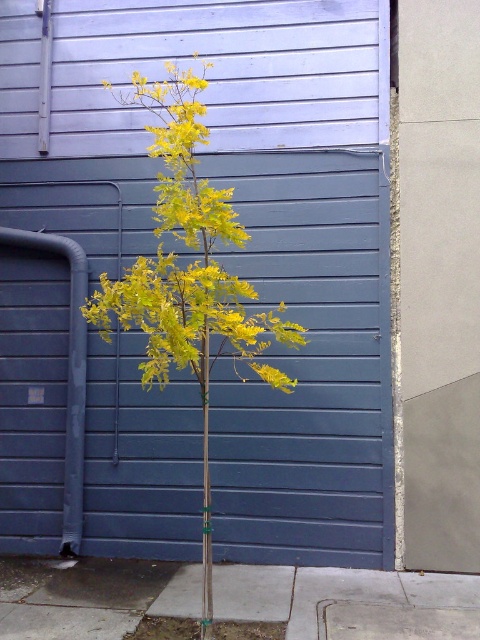
Which is more to the right, blue painted wood at center or yellow-green leaves at center?

Positioned to the right is blue painted wood at center.

Between blue painted wood at center and yellow-green leaves at center, which one appears on the left side from the viewer's perspective?

Positioned to the left is yellow-green leaves at center.

This screenshot has height=640, width=480. Identify the location of blue painted wood at center. (309, 365).

Can you confirm if gray concrete pavement at center is wider than yellow-green leaves at center?

Yes, gray concrete pavement at center is wider than yellow-green leaves at center.

Does gray concrete pavement at center have a larger size compared to yellow-green leaves at center?

No, gray concrete pavement at center is not bigger than yellow-green leaves at center.

Identify the location of gray concrete pavement at center. The width and height of the screenshot is (480, 640). (349, 602).

Describe the element at coordinates (309, 365) in the screenshot. This screenshot has width=480, height=640. I see `blue painted wood at center` at that location.

Between point (251, 520) and point (226, 586), which one is positioned in front?

Positioned in front is point (226, 586).

The height and width of the screenshot is (640, 480). In order to click on blue painted wood at center in this screenshot , I will do `click(309, 365)`.